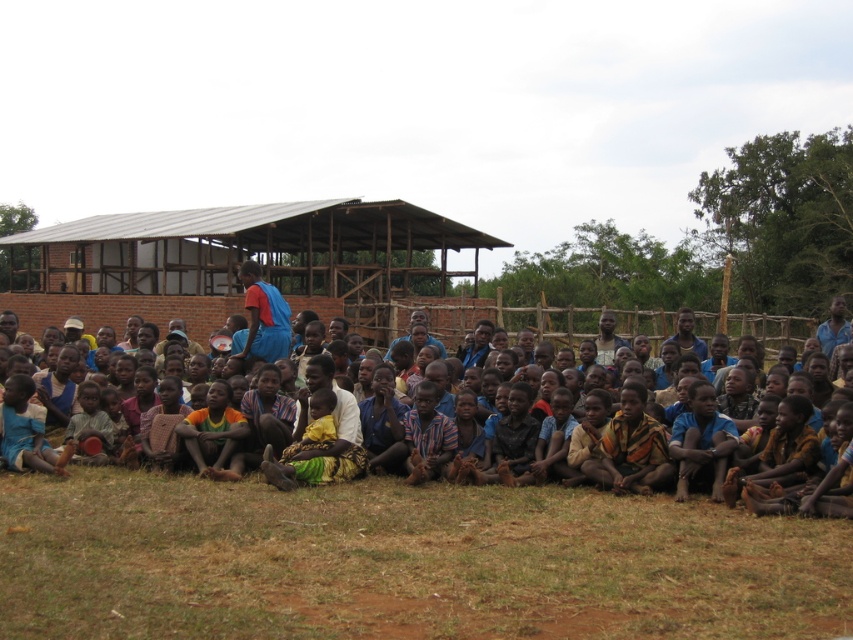
Does point (218, 285) come in front of point (233, 355)?

No, (218, 285) is further to viewer.

Based on the photo, which is more to the left, brown brick hut at center or blue fabric shirt at center?

brown brick hut at center

Locate an element on the screen. brown brick hut at center is located at coordinates (241, 260).

Image resolution: width=853 pixels, height=640 pixels. In order to click on brown brick hut at center in this screenshot , I will do `click(241, 260)`.

Is brown textured cloth at center wider than blue fabric shirt at center?

Yes, brown textured cloth at center is wider than blue fabric shirt at center.

Does point (196, 304) lie in front of point (283, 336)?

No, it is behind (283, 336).

Locate an element on the screen. Image resolution: width=853 pixels, height=640 pixels. brown textured cloth at center is located at coordinates (120, 310).

Which is above, brown brick hut at center or brown textured cloth at center?

brown brick hut at center is above.

Is brown brick hut at center behind brown textured cloth at center?

Yes, brown brick hut at center is behind brown textured cloth at center.

Who is more distant from viewer, (x=212, y=225) or (x=335, y=300)?

Positioned behind is point (x=212, y=225).

Where is `brown brick hut at center`? brown brick hut at center is located at coordinates coord(241,260).